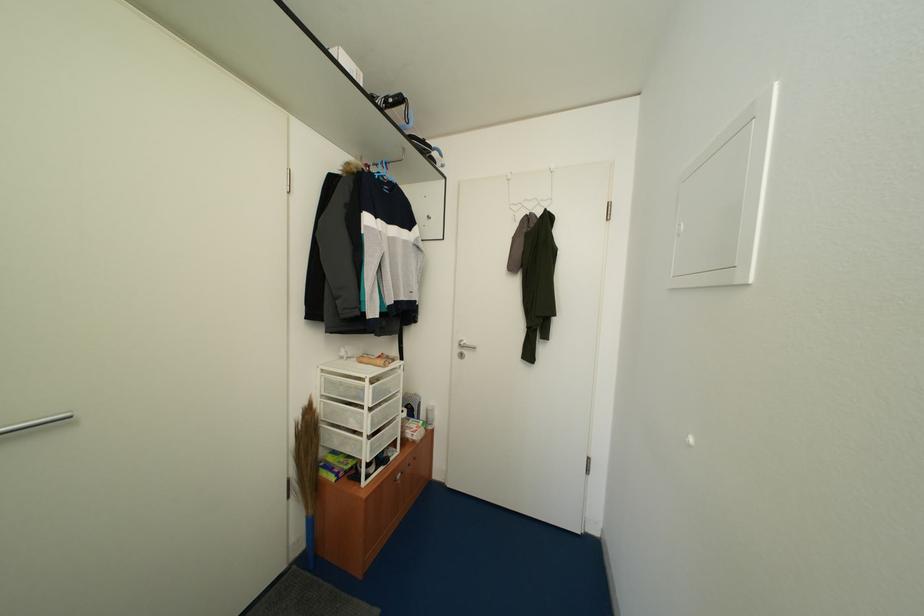
What do you see at coordinates (724, 201) in the screenshot? This screenshot has height=616, width=924. I see `a white panel latch` at bounding box center [724, 201].